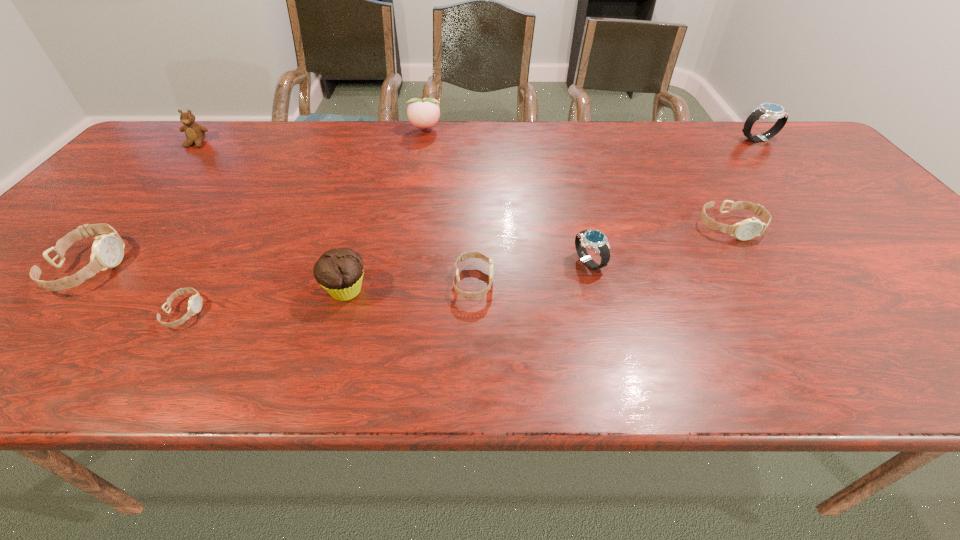
The width and height of the screenshot is (960, 540). I want to click on the smaller silver watch, so click(593, 239).

Find the location of a particular element. the third shortest watch is located at coordinates (747, 229).

This screenshot has width=960, height=540. I want to click on the second biggest beige watch, so click(x=747, y=229).

Where is `the fifth tallest watch`? the fifth tallest watch is located at coordinates (465, 255).

This screenshot has height=540, width=960. I want to click on the third biggest beige watch, so click(x=465, y=255).

At what (x,y) coordinates should I click in order to perform the action: click on the fifth watch from right to left. Please return your answer as a coordinate pair (x, y). The image size is (960, 540). Looking at the image, I should click on (195, 302).

The height and width of the screenshot is (540, 960). I want to click on the shortest watch, so click(x=195, y=302).

This screenshot has width=960, height=540. Find the location of `vacant space situated on the front of the peach`. vacant space situated on the front of the peach is located at coordinates (412, 204).

At what (x,y) coordinates should I click in order to perform the action: click on vacant space located 0.400m on the front of the farthest watch. Please return your answer as a coordinate pair (x, y). This screenshot has height=540, width=960. Looking at the image, I should click on (838, 232).

Locate an element on the screen. vacant space located at the face of the teddy bear is located at coordinates (135, 214).